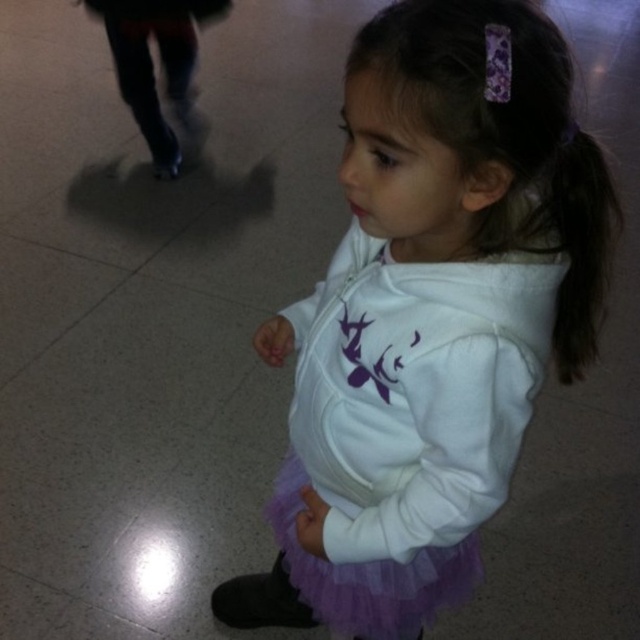
Can you confirm if purple silky hair at center is positioned to the left of purple tulle ballet skirt at center?

Incorrect, purple silky hair at center is not on the left side of purple tulle ballet skirt at center.

Is purple silky hair at center to the right of purple tulle ballet skirt at center from the viewer's perspective?

Yes, purple silky hair at center is to the right of purple tulle ballet skirt at center.

Who is more forward, (515, 180) or (464, 560)?

Point (515, 180) is more forward.

This screenshot has height=640, width=640. Find the location of `purple silky hair at center`. purple silky hair at center is located at coordinates (508, 140).

Between white fleece jacket at center and purple tulle ballet skirt at center, which one is positioned higher?

white fleece jacket at center is above.

Is point (378, 355) closer to camera compared to point (339, 621)?

Yes.

This screenshot has width=640, height=640. Find the location of `white fleece jacket at center`. white fleece jacket at center is located at coordinates tap(433, 305).

Does white fleece jacket at center have a greater height compared to purple silky hair at center?

Indeed, white fleece jacket at center has a greater height compared to purple silky hair at center.

Is point (349, 324) behind point (582, 147)?

Yes, point (349, 324) is farther from viewer.

You are a GUI agent. You are given a task and a screenshot of the screen. Output one action in this format:
    pyautogui.click(x=<x>, y=<y>)
    Task: Click on the white fleece jacket at center
    
    Given the screenshot: What is the action you would take?
    point(433,305)